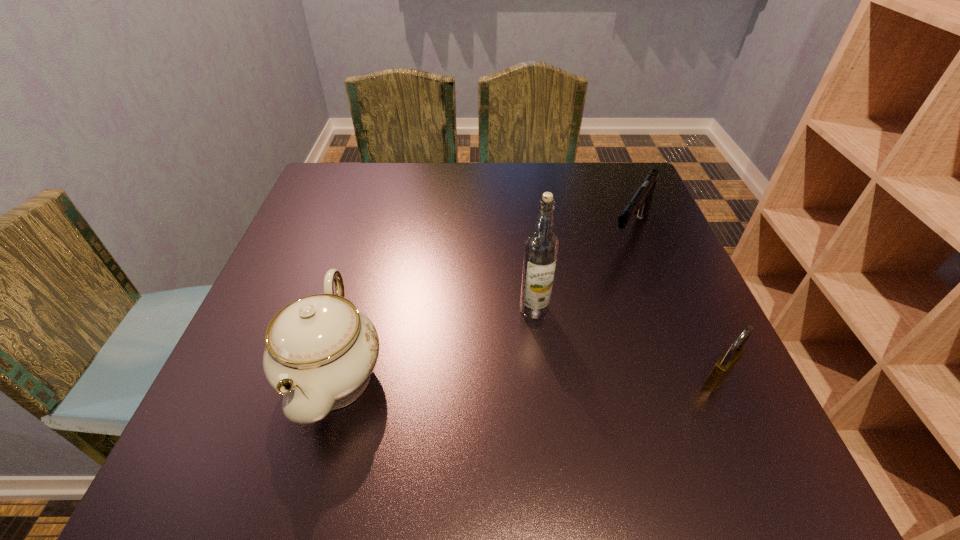
The width and height of the screenshot is (960, 540). What are the coordinates of `vacant area situated 0.110m on the label of the vodka` in the screenshot? It's located at (492, 353).

This screenshot has height=540, width=960. What are the coordinates of `free space located 0.130m on the label of the vodka` in the screenshot? It's located at (485, 360).

Identify the location of vacant area situated 0.080m on the label of the vodka. (501, 343).

Locate an element on the screen. object that is at the far edge is located at coordinates (640, 203).

This screenshot has height=540, width=960. I want to click on chinaware positioned at the near edge, so click(x=320, y=352).

Locate an element on the screen. padlock that is positioned at the near edge is located at coordinates (727, 361).

Where is `object that is at the left edge`? The image size is (960, 540). object that is at the left edge is located at coordinates (320, 352).

Where is `padlock at the right edge`? The image size is (960, 540). padlock at the right edge is located at coordinates (727, 361).

Find the location of `gun situated at the right edge`. gun situated at the right edge is located at coordinates (640, 203).

Identify the location of object located in the near left corner section of the desktop. (320, 352).